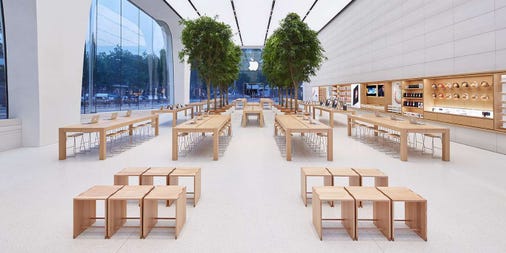
Where is `shelfs`? The height and width of the screenshot is (253, 506). shelfs is located at coordinates (416, 93).